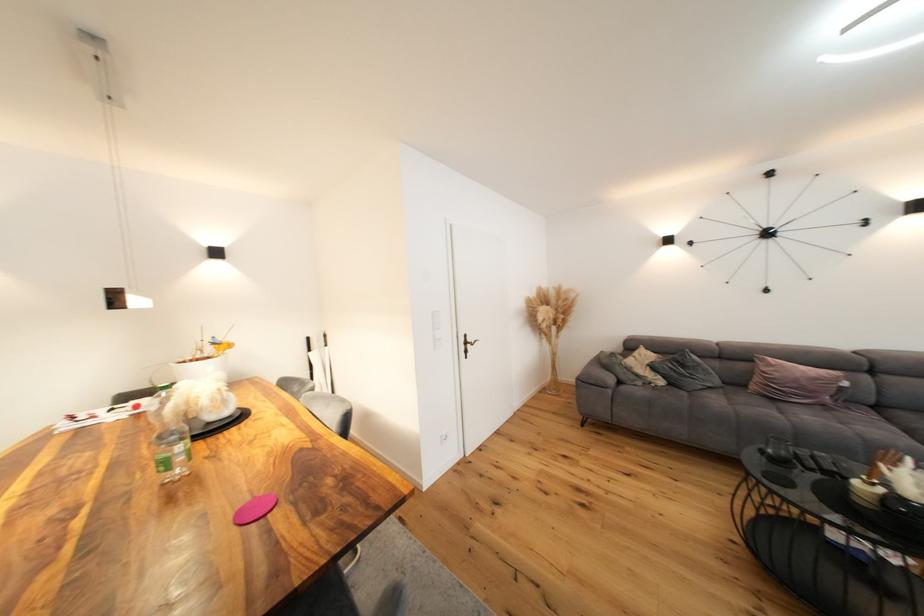
Where would you lift the pink pillow? Please return your answer as a coordinate pair (x, y).

(794, 382)